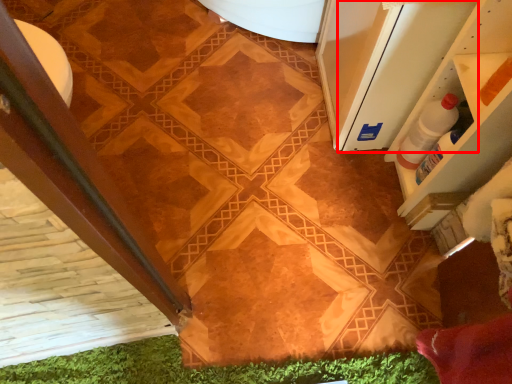
Question: Considering the relative positions of screen door (annotated by the red box) and bottle in the image provided, where is screen door (annotated by the red box) located with respect to the staircase?

Choices:
 (A) left
 (B) right

Answer: (A)